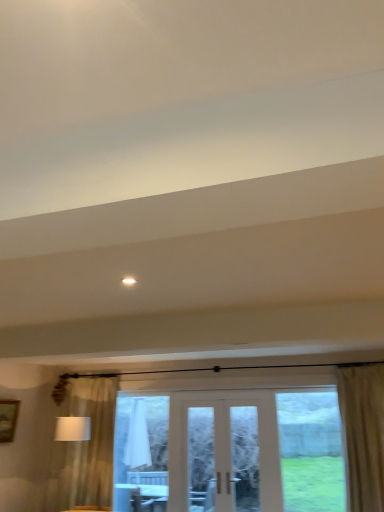
Describe the element at coordinates (8, 419) in the screenshot. The height and width of the screenshot is (512, 384). I see `wooden picture frame at left` at that location.

Measure the distance between white fabric lampshade at left and camera.

The depth of white fabric lampshade at left is 5.46 meters.

Find the location of `clear glass window at center`. clear glass window at center is located at coordinates (311, 452).

Where is `white fabric at center`? The width and height of the screenshot is (384, 512). white fabric at center is located at coordinates (141, 454).

This screenshot has height=512, width=384. What do you see at coordinates (362, 435) in the screenshot?
I see `beige textured curtain at right` at bounding box center [362, 435].

Where is `beige textured curtain at right`? The height and width of the screenshot is (512, 384). beige textured curtain at right is located at coordinates (362, 435).

Where is `wooden picture frame at left`? The image size is (384, 512). wooden picture frame at left is located at coordinates (8, 419).

Is clear glass door at center bigger than wooden picture frame at left?

Indeed, clear glass door at center has a larger size compared to wooden picture frame at left.

Is clear glass door at center turned away from wooden picture frame at left?

That's not correct — clear glass door at center is not looking away from wooden picture frame at left.

From a real-world perspective, does clear glass door at center stand above wooden picture frame at left?

No.

Considering the sizes of objects clear glass door at center and wooden picture frame at left in the image provided, who is thinner, clear glass door at center or wooden picture frame at left?

clear glass door at center.

This screenshot has height=512, width=384. I want to click on picture frame that appears behind the clear glass window at center, so click(x=8, y=419).

Which is more to the right, wooden picture frame at left or clear glass window at center?

clear glass window at center.

Is clear glass window at center facing away from clear glass door at center?

No, clear glass door at center is not at the back of clear glass window at center.

Is clear glass window at center far from clear glass door at center?

No, clear glass window at center is not far away from clear glass door at center.

Where is `window above the clear glass door at center (from the image's perspective)`? The height and width of the screenshot is (512, 384). window above the clear glass door at center (from the image's perspective) is located at coordinates (311, 452).

Which object is positioned more to the left, clear glass window at center or clear glass door at center?

clear glass door at center.

In the scene shown: Would you say clear glass window at center is part of white fabric at center's contents?

Definitely not — clear glass window at center is not inside white fabric at center.

Between white fabric at center and clear glass window at center, which one has less height?

With less height is clear glass window at center.

Is white fabric at center wider or thinner than clear glass window at center?

Clearly, white fabric at center has less width compared to clear glass window at center.

Is white glossy light at upper center inside the boundaries of white fabric lampshade at left, or outside?

white glossy light at upper center is spatially situated outside white fabric lampshade at left.

Who is bigger, white glossy light at upper center or white fabric lampshade at left?

white fabric lampshade at left.

Does point (134, 278) appear closer or farther from the camera than point (70, 419)?

Point (134, 278) appears to be closer to the viewer than point (70, 419).

Is white glossy light at upper center aimed at white fabric lampshade at left?

No.

Is beige textured curtain at right completely or partially outside of clear glass window at center?

Yes, beige textured curtain at right is outside of clear glass window at center.

Considering the sizes of objects beige textured curtain at right and clear glass window at center in the image provided, who is thinner, beige textured curtain at right or clear glass window at center?

clear glass window at center.

Who is shorter, beige textured curtain at right or clear glass window at center?

clear glass window at center.

From a real-world perspective, relative to clear glass window at center, is beige textured curtain at right vertically above or below?

From a real-world perspective, beige textured curtain at right is physically above clear glass window at center.

Considering the relative positions of clear glass window at center and wooden picture frame at left in the image provided, is clear glass window at center to the left or to the right of wooden picture frame at left?

clear glass window at center is to the right of wooden picture frame at left.

Can you see clear glass window at center touching wooden picture frame at left?

No, clear glass window at center is not making contact with wooden picture frame at left.

Would you say wooden picture frame at left is part of clear glass window at center's contents?

No.

From the image's perspective, would you say clear glass window at center is positioned over wooden picture frame at left?

Incorrect, from the image's perspective, clear glass window at center is lower than wooden picture frame at left.

The image size is (384, 512). I want to click on picture frame above the clear glass door at center (from a real-world perspective), so click(8, 419).

In order to click on picture frame behind the clear glass window at center in this screenshot , I will do `click(8, 419)`.

Looking at the image, which one is located closer to clear glass window at center, beige textured curtain at right or white glossy light at upper center?

The object closer to clear glass window at center is beige textured curtain at right.

From the picture: Estimate the real-world distances between objects in this image. Which object is closer to clear glass window at center, wooden picture frame at left or white fabric lampshade at left?

white fabric lampshade at left is closer to clear glass window at center.

Looking at the image, which one is located closer to clear glass door at center, white glossy light at upper center or wooden picture frame at left?

wooden picture frame at left is positioned closer to the anchor clear glass door at center.

Estimate the real-world distances between objects in this image. Which object is further from white fabric lampshade at left, white fabric at center or clear glass window at center?

clear glass window at center lies further to white fabric lampshade at left than the other object.

Which object lies further to the anchor point wooden picture frame at left, clear glass door at center or white fabric at center?

clear glass door at center is positioned further to the anchor wooden picture frame at left.

Looking at the image, which one is located closer to clear glass door at center, white fabric lampshade at left or white glossy light at upper center?

white fabric lampshade at left lies closer to clear glass door at center than the other object.

Which object lies nearer to the anchor point wooden picture frame at left, white fabric lampshade at left or white glossy light at upper center?

The object closer to wooden picture frame at left is white fabric lampshade at left.

Estimate the real-world distances between objects in this image. Which object is further from white fabric at center, wooden picture frame at left or white fabric lampshade at left?

wooden picture frame at left is further to white fabric at center.

Locate an element on the screen. This screenshot has height=512, width=384. picture frame between white glossy light at upper center and white fabric at center from front to back is located at coordinates (8, 419).

In order to click on window situated between wooden picture frame at left and beige textured curtain at right from left to right in this screenshot , I will do `click(311, 452)`.

Where is `table lamp between white glossy light at upper center and white fabric at center from front to back`? table lamp between white glossy light at upper center and white fabric at center from front to back is located at coordinates (73, 428).

Identify the location of door between white fabric lampshade at left and beige textured curtain at right from left to right. The height and width of the screenshot is (512, 384). (224, 452).